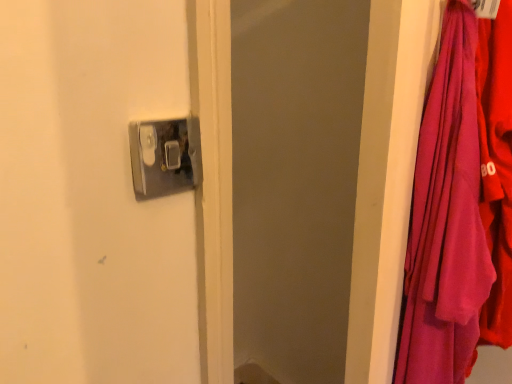
What do you see at coordinates (164, 157) in the screenshot?
I see `metallic silver door handle at upper center` at bounding box center [164, 157].

This screenshot has width=512, height=384. I want to click on metallic silver door handle at upper center, so click(x=164, y=157).

The width and height of the screenshot is (512, 384). In order to click on purple fabric at right in this screenshot , I will do `click(460, 206)`.

Measure the distance between point (441, 151) and camera.

They are 27.01 inches apart.

Describe the element at coordinates (460, 206) in the screenshot. I see `purple fabric at right` at that location.

Locate an element on the screen. Image resolution: width=512 pixels, height=384 pixels. metallic silver door handle at upper center is located at coordinates (164, 157).

In the image, is purple fabric at right on the left side or the right side of metallic silver door handle at upper center?

Clearly, purple fabric at right is on the right of metallic silver door handle at upper center in the image.

Which object is closer to the camera, purple fabric at right or metallic silver door handle at upper center?

purple fabric at right is more forward.

Is point (456, 238) farther from camera compared to point (143, 190)?

Yes, point (456, 238) is farther from viewer.

From the image's perspective, is purple fabric at right above metallic silver door handle at upper center?

No.

From a real-world perspective, between purple fabric at right and metallic silver door handle at upper center, who is vertically lower?

purple fabric at right, from a real-world perspective.

Considering the sizes of purple fabric at right and metallic silver door handle at upper center in the image, is purple fabric at right wider or thinner than metallic silver door handle at upper center?

purple fabric at right is wider than metallic silver door handle at upper center.

From their relative heights in the image, would you say purple fabric at right is taller or shorter than metallic silver door handle at upper center?

Considering their sizes, purple fabric at right has more height than metallic silver door handle at upper center.

Looking at the image, does purple fabric at right seem bigger or smaller compared to metallic silver door handle at upper center?

Clearly, purple fabric at right is larger in size than metallic silver door handle at upper center.

Is metallic silver door handle at upper center completely or partially inside purple fabric at right?

Definitely not — metallic silver door handle at upper center is not inside purple fabric at right.

From the picture: Is purple fabric at right placed right next to metallic silver door handle at upper center?

They are not placed beside each other.

Could you tell me if purple fabric at right is turned towards metallic silver door handle at upper center?

No, purple fabric at right does not turn towards metallic silver door handle at upper center.

How far apart are purple fabric at right and metallic silver door handle at upper center?

The distance of purple fabric at right from metallic silver door handle at upper center is 1.07 meters.

Locate an element on the screen. This screenshot has height=384, width=512. door handle above the purple fabric at right (from a real-world perspective) is located at coordinates (164, 157).

Visually, is metallic silver door handle at upper center positioned to the left or to the right of purple fabric at right?

metallic silver door handle at upper center is positioned on purple fabric at right's left side.

In the scene shown: Considering the positions of objects metallic silver door handle at upper center and purple fabric at right in the image provided, who is in front, metallic silver door handle at upper center or purple fabric at right?

purple fabric at right is closer to the camera.

Which is closer to the camera, (181, 152) or (419, 164)?

The point (419, 164) is in front.

From the image's perspective, does metallic silver door handle at upper center appear lower than purple fabric at right?

No, from the image's perspective, metallic silver door handle at upper center is not beneath purple fabric at right.

Consider the image. From a real-world perspective, between metallic silver door handle at upper center and purple fabric at right, who is vertically lower?

purple fabric at right.

Considering the sizes of objects metallic silver door handle at upper center and purple fabric at right in the image provided, who is thinner, metallic silver door handle at upper center or purple fabric at right?

Thinner between the two is metallic silver door handle at upper center.

In terms of height, does metallic silver door handle at upper center look taller or shorter compared to purple fabric at right?

In the image, metallic silver door handle at upper center appears to be shorter than purple fabric at right.

Considering the sizes of objects metallic silver door handle at upper center and purple fabric at right in the image provided, who is bigger, metallic silver door handle at upper center or purple fabric at right?

With larger size is purple fabric at right.

Is metallic silver door handle at upper center not within purple fabric at right?

metallic silver door handle at upper center is positioned outside purple fabric at right.

Is metallic silver door handle at upper center not close to purple fabric at right?

Yes.

Is metallic silver door handle at upper center facing towards purple fabric at right?

No.

You are a GUI agent. You are given a task and a screenshot of the screen. Output one action in this format:
    pyautogui.click(x=<x>, y=<y>)
    Task: Click on the curtain below the metallic silver door handle at upper center (from the image's perspective)
    The height and width of the screenshot is (384, 512).
    Given the screenshot: What is the action you would take?
    pyautogui.click(x=460, y=206)

This screenshot has height=384, width=512. In order to click on curtain that appears below the metallic silver door handle at upper center (from the image's perspective) in this screenshot , I will do `click(460, 206)`.

Where is `door handle that appears above the purple fabric at right (from a real-world perspective)`? door handle that appears above the purple fabric at right (from a real-world perspective) is located at coordinates (164, 157).